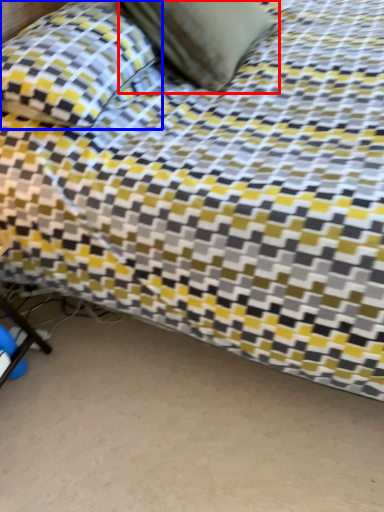
Question: Which object appears closest to the camera in this image, pillow (highlighted by a red box) or pillow (highlighted by a blue box)?

Choices:
 (A) pillow
 (B) pillow

Answer: (B)